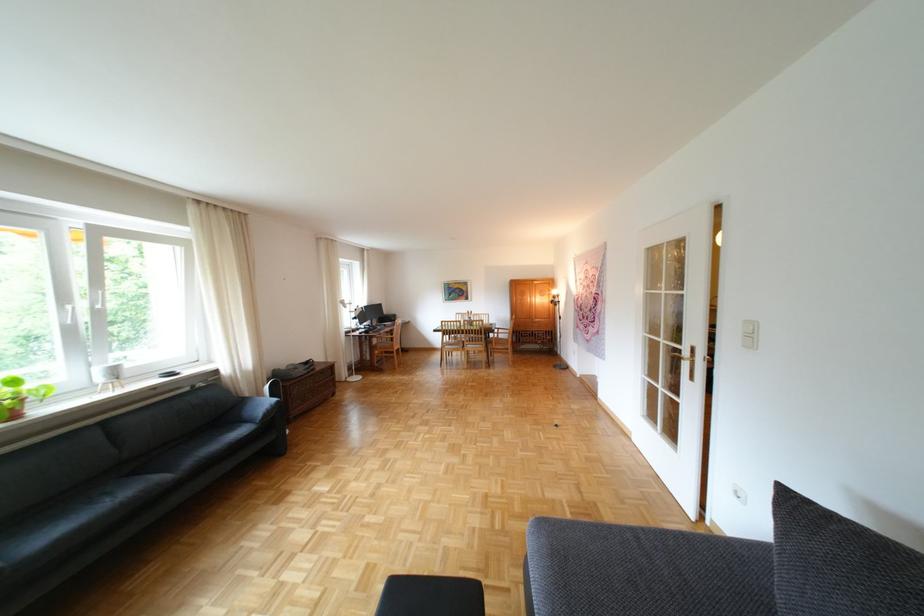
The height and width of the screenshot is (616, 924). What do you see at coordinates (679, 357) in the screenshot? I see `the gold door handle` at bounding box center [679, 357].